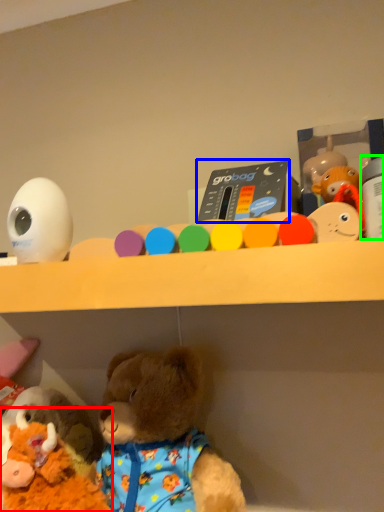
Question: Estimate the real-world distances between objects in this image. Which object is farther from toy (highlighted by a red box), toy (highlighted by a blue box) or toy (highlighted by a green box)?

Choices:
 (A) toy
 (B) toy

Answer: (B)